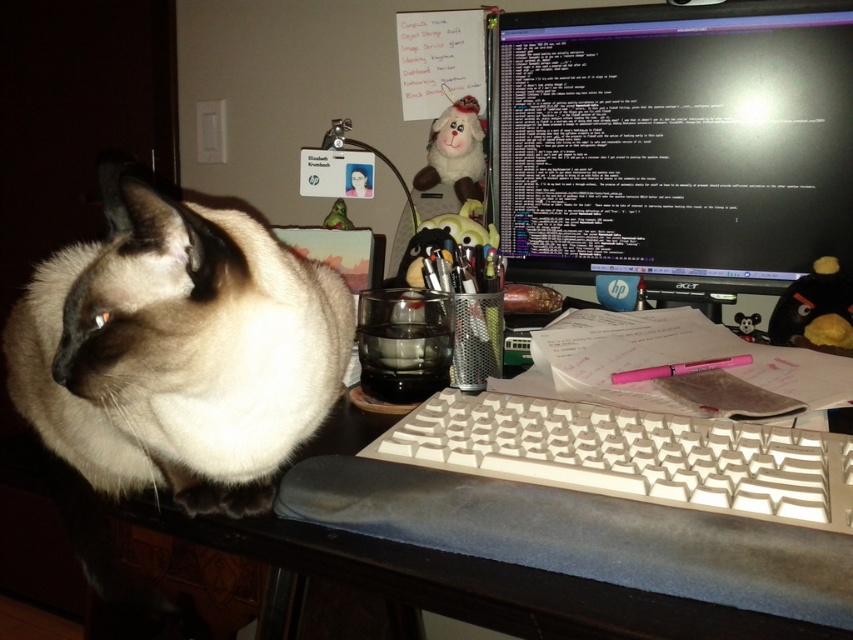
You are a remote worker who needs to place a new wireless keyboard on your desk. The keyboard requires 0.3 meters of space in front of it to function properly. Given the current desk layout described, can you place the keyboard between the black glossy monitor at upper right and the point marked at coordinate point (676, 144)? Please explain your reasoning.

The point marked at coordinate point (676, 144) corresponds to the black glossy monitor at upper right. Since both refer to the same object, there is no space between them to place the keyboard. Therefore, the keyboard cannot be placed between them as they are the same location.

You are a delivery robot trying to place a package on the desk. The desk has a smokey white fur cat at left and a computer monitor on the right. Can you place the package on the desk without disturbing the cat?

The smokey white fur cat at left is located at point (177,349). Since the cat is on the left side of the desk and the computer monitor is on the right, there should be space on the desk between them or on the right side of the monitor to place the package without disturbing the cat.